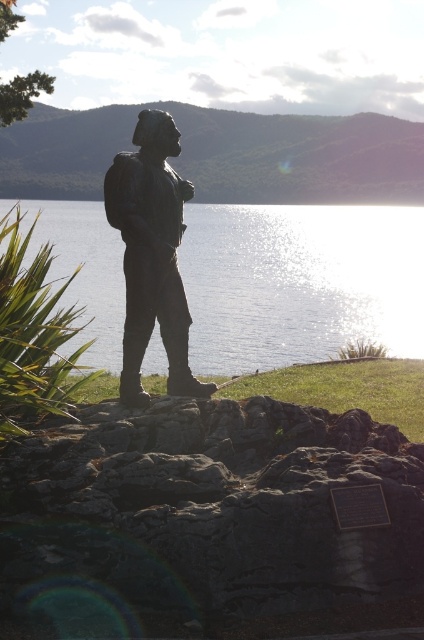
Question: Is rough textured rock at center thinner than glistening metallic water at center?

Choices:
 (A) yes
 (B) no

Answer: (A)

Question: Does glistening metallic water at center have a smaller size compared to bronze statue at center?

Choices:
 (A) no
 (B) yes

Answer: (A)

Question: Which object is closer to the camera taking this photo?

Choices:
 (A) glistening metallic water at center
 (B) bronze statue at center
 (C) rough textured rock at center

Answer: (C)

Question: Which point is closer to the camera taking this photo?

Choices:
 (A) (237, 221)
 (B) (161, 330)
 (C) (203, 406)

Answer: (C)

Question: Which of the following is the farthest from the observer?

Choices:
 (A) bronze statue at center
 (B) rough textured rock at center

Answer: (A)

Question: Can you confirm if rough textured rock at center is positioned above glistening metallic water at center?

Choices:
 (A) yes
 (B) no

Answer: (B)